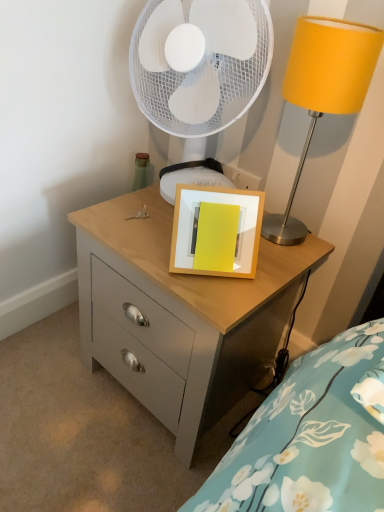
Locate an element on the screen. Image resolution: width=384 pixels, height=512 pixels. free space above matte wood chest of drawers at center (from a real-world perspective) is located at coordinates (168, 228).